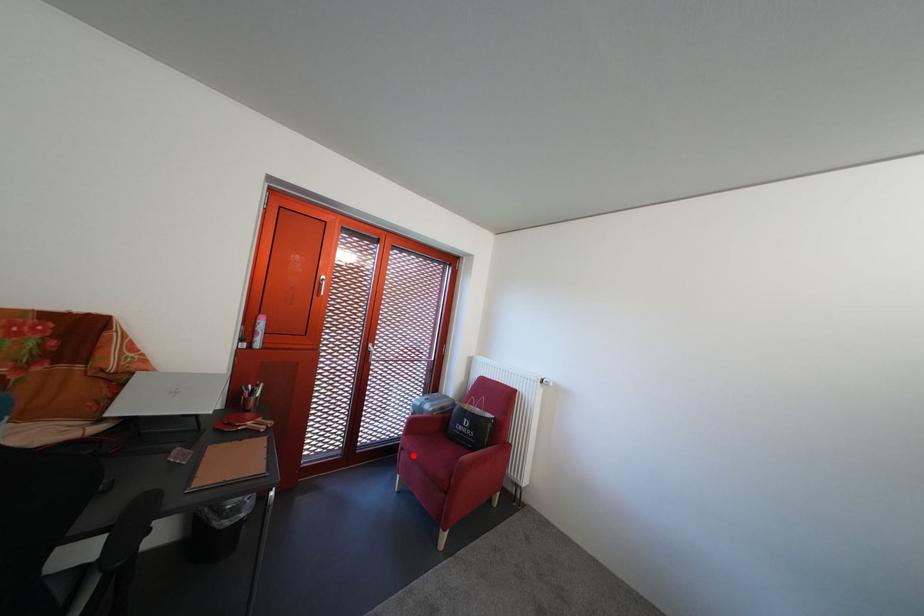
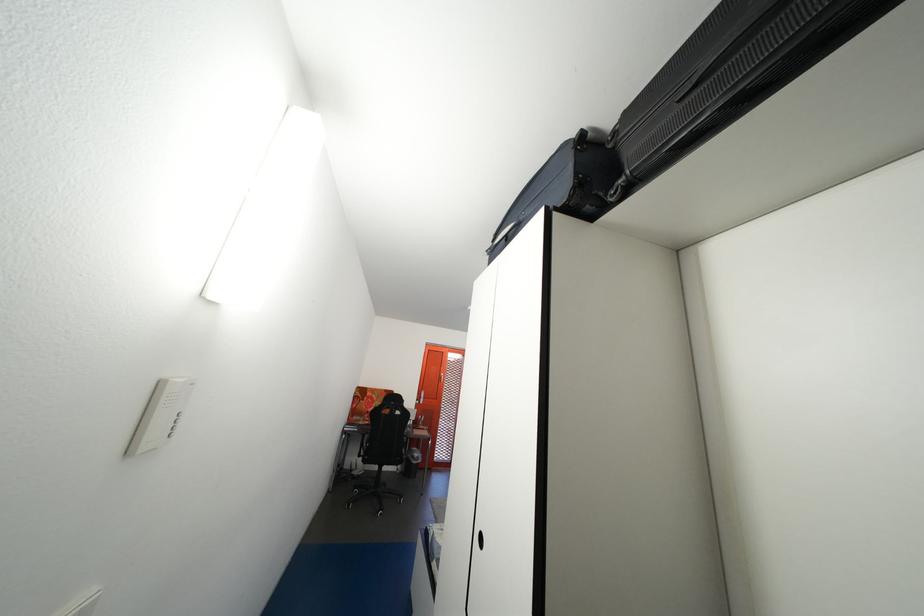
Question: I am providing you with two images of the same scene from different viewpoints. A red point is marked on the first image. Is the red point's position out of view in image 2?

Choices:
 (A) Yes
 (B) No

Answer: (A)